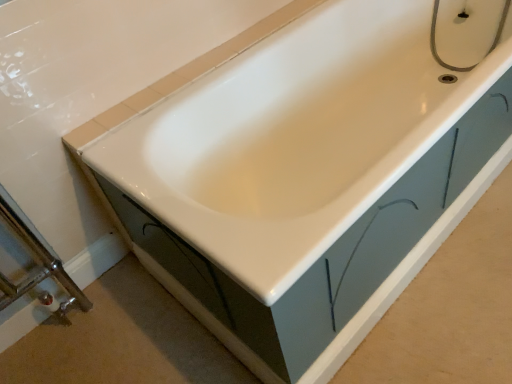
Describe the element at coordinates (31, 264) in the screenshot. I see `brushed metal shower door at lower left` at that location.

The image size is (512, 384). Identify the location of brushed metal shower door at lower left. (31, 264).

Measure the distance between matte silver faucet at upper right and camera.

The distance of matte silver faucet at upper right from camera is 5.31 feet.

Identify the location of matte silver faucet at upper right. (435, 44).

This screenshot has height=384, width=512. What do you see at coordinates (435, 44) in the screenshot?
I see `matte silver faucet at upper right` at bounding box center [435, 44].

Locate an element on the screen. The width and height of the screenshot is (512, 384). brushed metal shower door at lower left is located at coordinates (31, 264).

Does matte silver faucet at upper right appear on the right side of brushed metal shower door at lower left?

Yes, matte silver faucet at upper right is to the right of brushed metal shower door at lower left.

In the image, is matte silver faucet at upper right positioned in front of or behind brushed metal shower door at lower left?

In the image, matte silver faucet at upper right appears behind brushed metal shower door at lower left.

Is point (448, 65) positioned after point (0, 309)?

Yes, it is behind point (0, 309).

From the image's perspective, which is below, matte silver faucet at upper right or brushed metal shower door at lower left?

brushed metal shower door at lower left.

From a real-world perspective, which is physically below, matte silver faucet at upper right or brushed metal shower door at lower left?

From a 3D spatial view, brushed metal shower door at lower left is below.

Considering the sizes of objects matte silver faucet at upper right and brushed metal shower door at lower left in the image provided, who is thinner, matte silver faucet at upper right or brushed metal shower door at lower left?

With smaller width is brushed metal shower door at lower left.

In terms of height, does matte silver faucet at upper right look taller or shorter compared to brushed metal shower door at lower left?

In the image, matte silver faucet at upper right appears to be shorter than brushed metal shower door at lower left.

Who is smaller, matte silver faucet at upper right or brushed metal shower door at lower left?

matte silver faucet at upper right.

Is brushed metal shower door at lower left a part of matte silver faucet at upper right?

That's incorrect, brushed metal shower door at lower left is not inside matte silver faucet at upper right.

Is matte silver faucet at upper right touching brushed metal shower door at lower left?

No, matte silver faucet at upper right is not making contact with brushed metal shower door at lower left.

Does matte silver faucet at upper right turn towards brushed metal shower door at lower left?

Yes, matte silver faucet at upper right is oriented towards brushed metal shower door at lower left.

How different are the orientations of matte silver faucet at upper right and brushed metal shower door at lower left in degrees?

They differ by 89.6 degrees in their facing directions.

Locate an element on the screen. shower door located below the matte silver faucet at upper right (from the image's perspective) is located at coordinates (31, 264).

Considering the relative positions of brushed metal shower door at lower left and matte silver faucet at upper right in the image provided, is brushed metal shower door at lower left to the right of matte silver faucet at upper right from the viewer's perspective?

No.

Which object is closer to the camera taking this photo, brushed metal shower door at lower left or matte silver faucet at upper right?

brushed metal shower door at lower left.

Which point is more forward, (30,267) or (436,59)?

The point (30,267) is in front.

From the image's perspective, is brushed metal shower door at lower left located beneath matte silver faucet at upper right?

Yes, from the image's perspective, brushed metal shower door at lower left is below matte silver faucet at upper right.

From a real-world perspective, which is physically above, brushed metal shower door at lower left or matte silver faucet at upper right?

matte silver faucet at upper right.

Is brushed metal shower door at lower left thinner than matte silver faucet at upper right?

Yes.

Is brushed metal shower door at lower left taller than matte silver faucet at upper right?

Yes.

Considering the sizes of brushed metal shower door at lower left and matte silver faucet at upper right in the image, is brushed metal shower door at lower left bigger or smaller than matte silver faucet at upper right?

Considering their sizes, brushed metal shower door at lower left takes up more space than matte silver faucet at upper right.

Which is correct: brushed metal shower door at lower left is inside matte silver faucet at upper right, or outside of it?

brushed metal shower door at lower left is outside matte silver faucet at upper right.

Is brushed metal shower door at lower left with matte silver faucet at upper right?

brushed metal shower door at lower left and matte silver faucet at upper right are clearly separated.

Could you tell me if brushed metal shower door at lower left is facing matte silver faucet at upper right?

No, brushed metal shower door at lower left is not turned towards matte silver faucet at upper right.

Where is `shower door to the left of matte silver faucet at upper right`? This screenshot has width=512, height=384. shower door to the left of matte silver faucet at upper right is located at coordinates (31, 264).

What are the coordinates of `shower door to the left of matte silver faucet at upper right` in the screenshot? It's located at (31, 264).

In order to click on plumbing fixture behind the brushed metal shower door at lower left in this screenshot , I will do `click(435, 44)`.